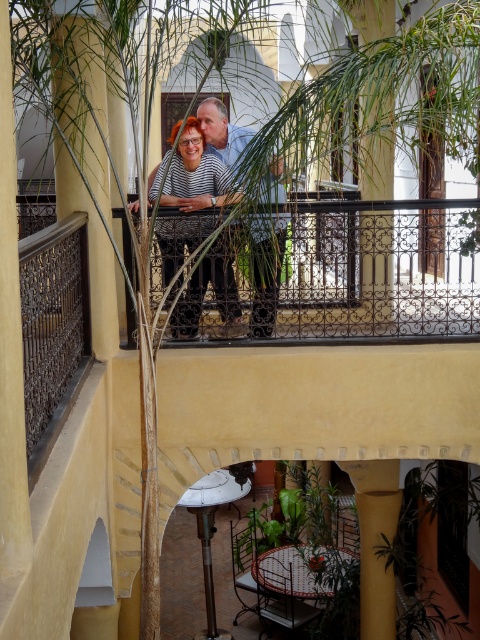
Between striped fabric shirt at center and light blue shirt at center, which one has more height?

striped fabric shirt at center is taller.

Does striped fabric shirt at center have a lesser height compared to light blue shirt at center?

In fact, striped fabric shirt at center may be taller than light blue shirt at center.

Is point (162, 196) positioned before point (255, 225)?

No, (162, 196) is further to viewer.

Identify the location of striped fabric shirt at center. The image size is (480, 640). click(x=193, y=173).

The width and height of the screenshot is (480, 640). Describe the element at coordinates (193, 173) in the screenshot. I see `striped fabric shirt at center` at that location.

Who is shorter, striped fabric shirt at center or smooth yellow pillar at center?

striped fabric shirt at center is shorter.

What are the coordinates of `striped fabric shirt at center` in the screenshot? It's located at (193, 173).

Can you confirm if smooth yellow pillar at center is thinner than light blue shirt at center?

No.

Which of these two, smooth yellow pillar at center or light blue shirt at center, stands shorter?

Standing shorter between the two is light blue shirt at center.

Between point (393, 627) and point (269, 301), which one is positioned behind?

The point (393, 627) is behind.

The image size is (480, 640). I want to click on smooth yellow pillar at center, so click(375, 541).